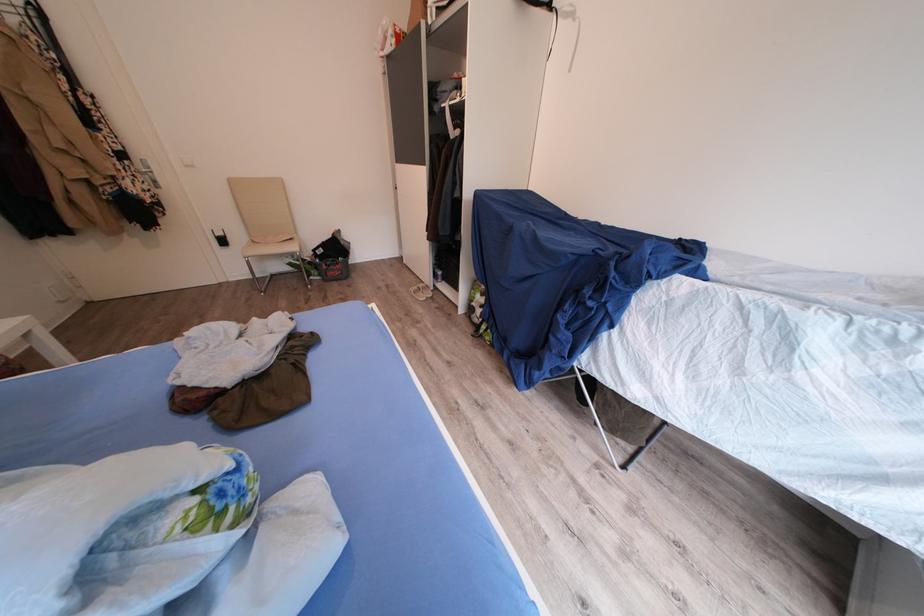
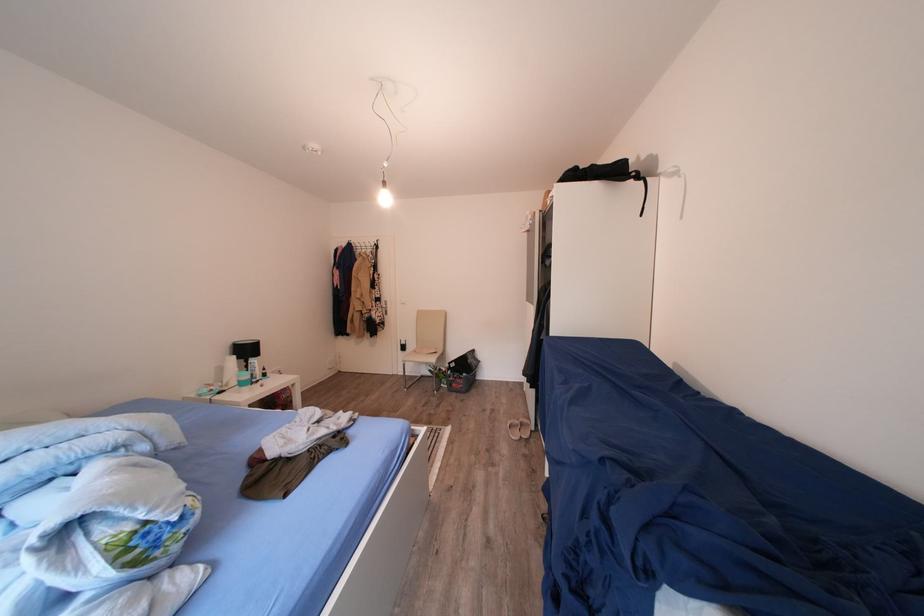
The point at (232, 246) is marked in the first image. Where is the corresponding point in the second image?

(411, 353)